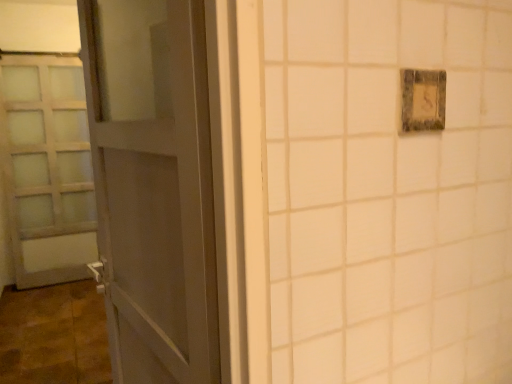
Find the location of a particular element. The width and height of the screenshot is (512, 384). matte gray door at left, which is the 1th door in right-to-left order is located at coordinates (153, 186).

Where is `matte gray door at left, the 2th door viewed from the back`? matte gray door at left, the 2th door viewed from the back is located at coordinates (153, 186).

Is satin white door at left, which is counted as the second door, starting from the front, positioned with its back to matte gray door at left, the 2th door viewed from the left?

That's not correct — satin white door at left, which is counted as the second door, starting from the front, is not looking away from matte gray door at left, the 2th door viewed from the left.

Which is correct: satin white door at left, which is counted as the second door, starting from the front, is inside matte gray door at left, the 2th door viewed from the left, or outside of it?

satin white door at left, which is counted as the second door, starting from the front, exists outside the volume of matte gray door at left, the 2th door viewed from the left.

Considering the points (36, 265) and (131, 268), which point is behind, point (36, 265) or point (131, 268)?

Positioned behind is point (36, 265).

Is satin white door at left, the second door in the right-to-left sequence, closer to camera compared to matte gray door at left, the first door positioned from the front?

No, satin white door at left, the second door in the right-to-left sequence, is further to the viewer.

Considering the relative sizes of matte gray door at left, which is the 1th door in right-to-left order, and satin white door at left, the 1th door viewed from the back, in the image provided, is matte gray door at left, which is the 1th door in right-to-left order, wider than satin white door at left, the 1th door viewed from the back,?

Yes.

Considering the relative positions of matte gray door at left, the 2th door viewed from the back, and satin white door at left, the 1th door viewed from the left, in the image provided, is matte gray door at left, the 2th door viewed from the back, to the left or to the right of satin white door at left, the 1th door viewed from the left,?

In the image, matte gray door at left, the 2th door viewed from the back, appears on the right side of satin white door at left, the 1th door viewed from the left.

Consider the image. Is matte gray door at left, the 2th door viewed from the back, aimed at satin white door at left, the 1th door viewed from the left?

No, matte gray door at left, the 2th door viewed from the back, is not facing towards satin white door at left, the 1th door viewed from the left.

In the scene shown: From the image's perspective, is rustic wood light switch at upper right located above or below satin white door at left, the second door in the right-to-left sequence?

rustic wood light switch at upper right is below satin white door at left, the second door in the right-to-left sequence.

Consider the image. Does rustic wood light switch at upper right touch satin white door at left, the 1th door viewed from the back?

No.

Does rustic wood light switch at upper right lie in front of satin white door at left, the 1th door viewed from the left?

Yes, rustic wood light switch at upper right is closer to the viewer.

Is rustic wood light switch at upper right inside the boundaries of satin white door at left, the 1th door viewed from the left, or outside?

rustic wood light switch at upper right lies outside satin white door at left, the 1th door viewed from the left.

Considering the relative positions of matte gray door at left, the 2th door viewed from the back, and rustic wood light switch at upper right in the image provided, is matte gray door at left, the 2th door viewed from the back, to the left or to the right of rustic wood light switch at upper right?

Based on their positions, matte gray door at left, the 2th door viewed from the back, is located to the left of rustic wood light switch at upper right.

Considering the sizes of objects matte gray door at left, the 2th door viewed from the back, and rustic wood light switch at upper right in the image provided, who is taller, matte gray door at left, the 2th door viewed from the back, or rustic wood light switch at upper right?

matte gray door at left, the 2th door viewed from the back, is taller.

Which is correct: matte gray door at left, which is the 1th door in right-to-left order, is inside rustic wood light switch at upper right, or outside of it?

matte gray door at left, which is the 1th door in right-to-left order, is located beyond the bounds of rustic wood light switch at upper right.

Would you consider satin white door at left, the second door in the right-to-left sequence, to be distant from rustic wood light switch at upper right?

satin white door at left, the second door in the right-to-left sequence, is far away from rustic wood light switch at upper right.

Is satin white door at left, the second door in the right-to-left sequence, facing away from rustic wood light switch at upper right?

Answer: No.

Can you confirm if satin white door at left, the 1th door viewed from the left, is thinner than rustic wood light switch at upper right?

Incorrect, the width of satin white door at left, the 1th door viewed from the left, is not less than that of rustic wood light switch at upper right.

Do you think satin white door at left, which is counted as the second door, starting from the front, is within rustic wood light switch at upper right, or outside of it?

The correct answer is: outside.

Considering the relative sizes of rustic wood light switch at upper right and matte gray door at left, the 2th door viewed from the left, in the image provided, is rustic wood light switch at upper right taller than matte gray door at left, the 2th door viewed from the left,?

No.

From a real-world perspective, is rustic wood light switch at upper right located beneath matte gray door at left, the 2th door viewed from the back?

No.

Considering the positions of objects rustic wood light switch at upper right and matte gray door at left, the first door positioned from the front, in the image provided, who is behind, rustic wood light switch at upper right or matte gray door at left, the first door positioned from the front,?

rustic wood light switch at upper right is further away from the camera.

Looking at this image, which object is positioned more to the left, rustic wood light switch at upper right or matte gray door at left, the 2th door viewed from the back?

matte gray door at left, the 2th door viewed from the back.

At what (x,y) coordinates should I click in order to perform the action: click on door that appears below the matte gray door at left, the first door positioned from the front (from a real-world perspective). Please return your answer as a coordinate pair (x, y). Looking at the image, I should click on pos(45,151).

I want to click on door that appears on the right of satin white door at left, which is counted as the second door, starting from the front, so click(x=153, y=186).

Which object lies further to the anchor point satin white door at left, which is counted as the second door, starting from the front, rustic wood light switch at upper right or matte gray door at left, the 2th door viewed from the left?

The object further to satin white door at left, which is counted as the second door, starting from the front, is rustic wood light switch at upper right.

Considering their positions, is satin white door at left, the second door in the right-to-left sequence, positioned further to rustic wood light switch at upper right than matte gray door at left, which is the 1th door in right-to-left order?

The object further to rustic wood light switch at upper right is satin white door at left, the second door in the right-to-left sequence.

Looking at the image, which one is located closer to matte gray door at left, the 2th door viewed from the back, satin white door at left, the 1th door viewed from the left, or rustic wood light switch at upper right?

rustic wood light switch at upper right lies closer to matte gray door at left, the 2th door viewed from the back, than the other object.

When comparing their distances from matte gray door at left, the 2th door viewed from the left, does rustic wood light switch at upper right or satin white door at left, which is counted as the second door, starting from the front, seem closer?

Based on the image, rustic wood light switch at upper right appears to be nearer to matte gray door at left, the 2th door viewed from the left.

Based on their spatial positions, is matte gray door at left, the 2th door viewed from the left, or satin white door at left, the 1th door viewed from the back, further from rustic wood light switch at upper right?

satin white door at left, the 1th door viewed from the back, is further to rustic wood light switch at upper right.

When comparing their distances from satin white door at left, the second door in the right-to-left sequence, does matte gray door at left, the first door positioned from the front, or rustic wood light switch at upper right seem closer?

matte gray door at left, the first door positioned from the front.

I want to click on light switch between matte gray door at left, the 2th door viewed from the back, and satin white door at left, the second door in the right-to-left sequence, from front to back, so click(x=423, y=99).